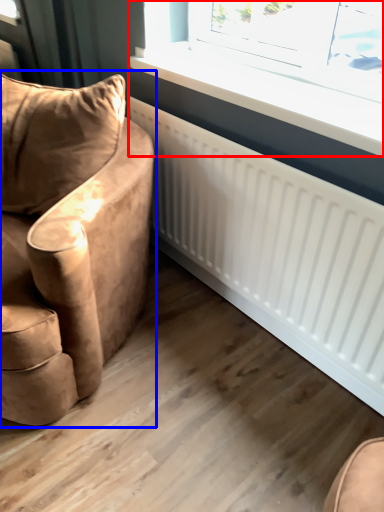
Question: Which object appears farthest to the camera in this image, window (highlighted by a red box) or chair (highlighted by a blue box)?

Choices:
 (A) window
 (B) chair

Answer: (A)